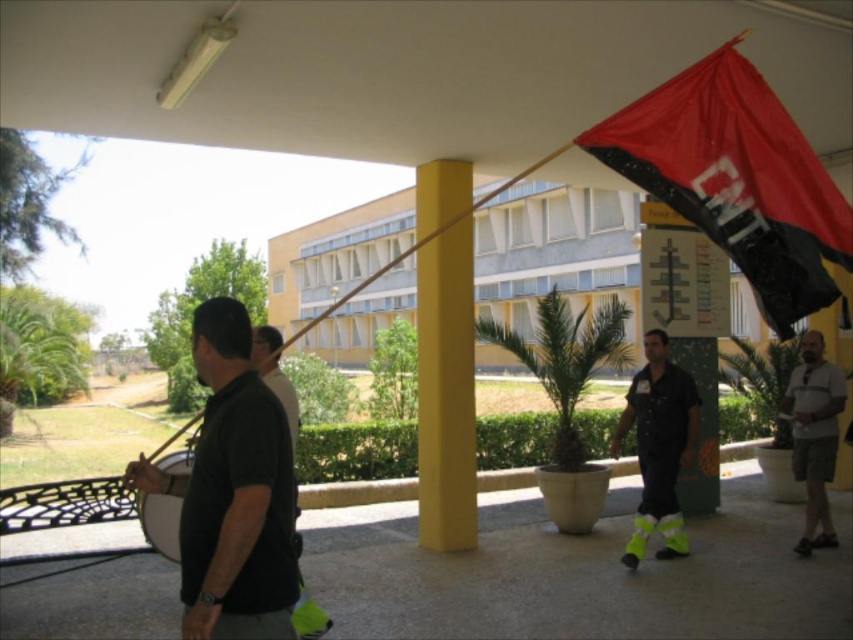
Looking at this image, you are a photographer positioned at the neon yellow reflective pants at center. You want to capture a photo of the black matte shirt at left without any obstructions. Given that your camera has a maximum focus range of 4 meters, will you be able to take the photo clearly?

The distance between the black matte shirt at left and neon yellow reflective pants at center is 3.96 meters, which is within the camera maximum focus range of 4 meters. Therefore, you can take the photo clearly.

Looking at this image, please provide the 2D coordinates of the black matte shirt at left in the scene described. Your answer should include the coordinates as given in the Objects Description.

The black matte shirt at left is located at the 2D coordinates of point (233, 492).

You are a photographer standing at the back of the walkway. You want to capture a photo that includes both the black matte shirt at left and the neon yellow reflective pants at center. Based on their positions, which one should you adjust your camera angle to focus on first to ensure both are in the frame?

Since the black matte shirt at left is in front of the neon yellow reflective pants at center, you should focus on the black matte shirt at left first to ensure it doesn not block the view of the neon yellow reflective pants at center.